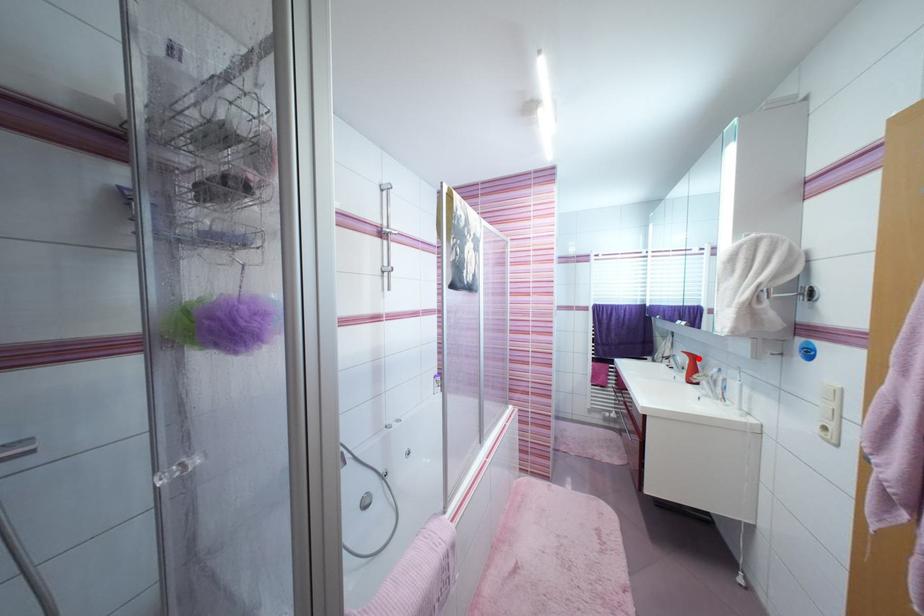
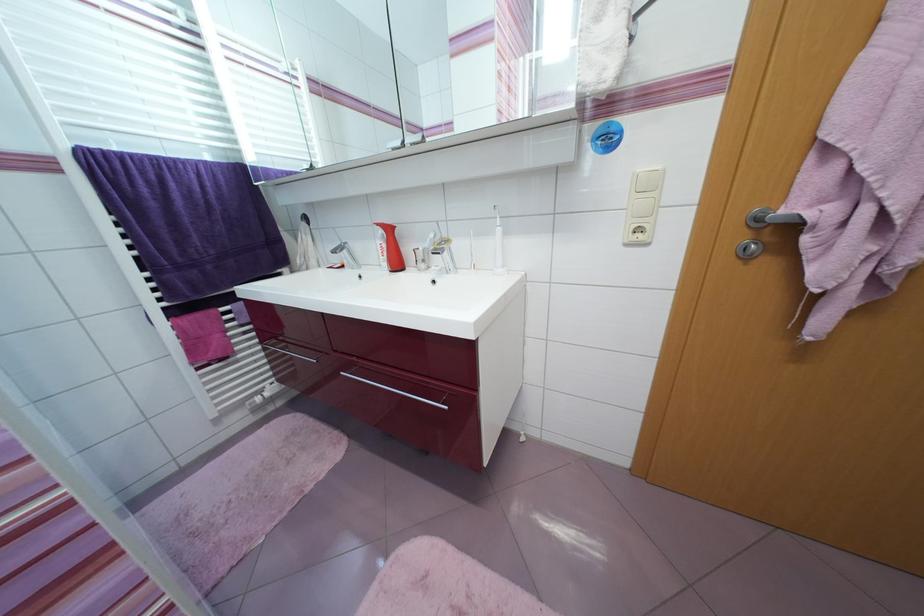
Find the pixel in the second image that matches the highlighted location in the first image.

(394, 231)